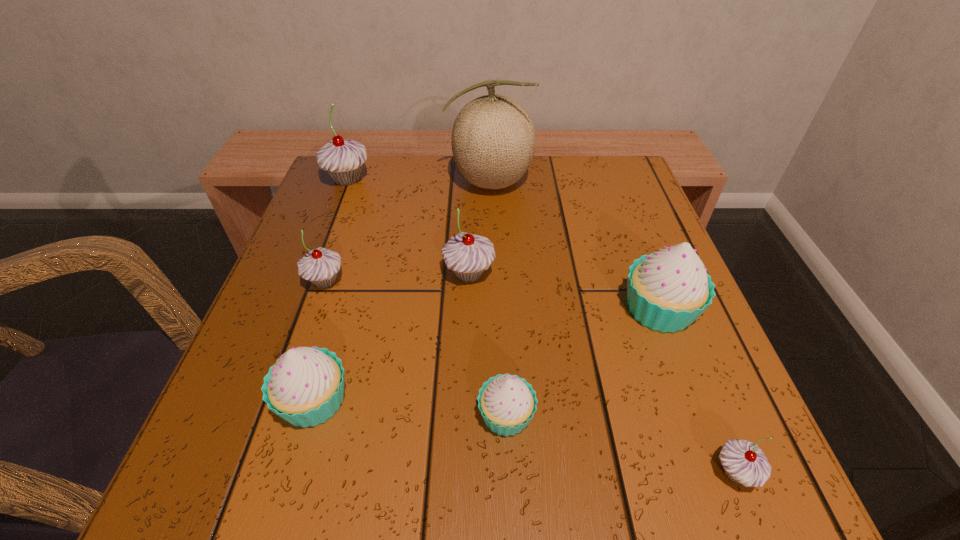
Where is `cupcake that is at the far edge`? The width and height of the screenshot is (960, 540). cupcake that is at the far edge is located at coordinates (342, 159).

Locate an element on the screen. object at the far left corner is located at coordinates (342, 159).

Find the location of a particular element. The width and height of the screenshot is (960, 540). object present at the near right corner is located at coordinates (743, 462).

At what (x,y) coordinates should I click in order to perform the action: click on vacant space at the far edge of the desktop. Please return your answer as a coordinate pair (x, y). Looking at the image, I should click on (504, 204).

In the image, there is a desktop. Find the location of `free region at the near edge`. free region at the near edge is located at coordinates (374, 440).

Where is `vacant space at the left edge`? vacant space at the left edge is located at coordinates (308, 308).

The height and width of the screenshot is (540, 960). Find the location of `free space at the right edge`. free space at the right edge is located at coordinates (681, 385).

The image size is (960, 540). In order to click on vacant area at the far left corner in this screenshot , I will do `click(371, 199)`.

At what (x,y) coordinates should I click in order to perform the action: click on vacant space at the far right corner of the desktop. Please return your answer as a coordinate pair (x, y). The width and height of the screenshot is (960, 540). Looking at the image, I should click on (613, 160).

You are a GUI agent. You are given a task and a screenshot of the screen. Output one action in this format:
    pyautogui.click(x=<x>, y=<y>)
    Task: Click on the free location at the near right corner
    The width and height of the screenshot is (960, 540).
    Given the screenshot: What is the action you would take?
    pyautogui.click(x=732, y=496)